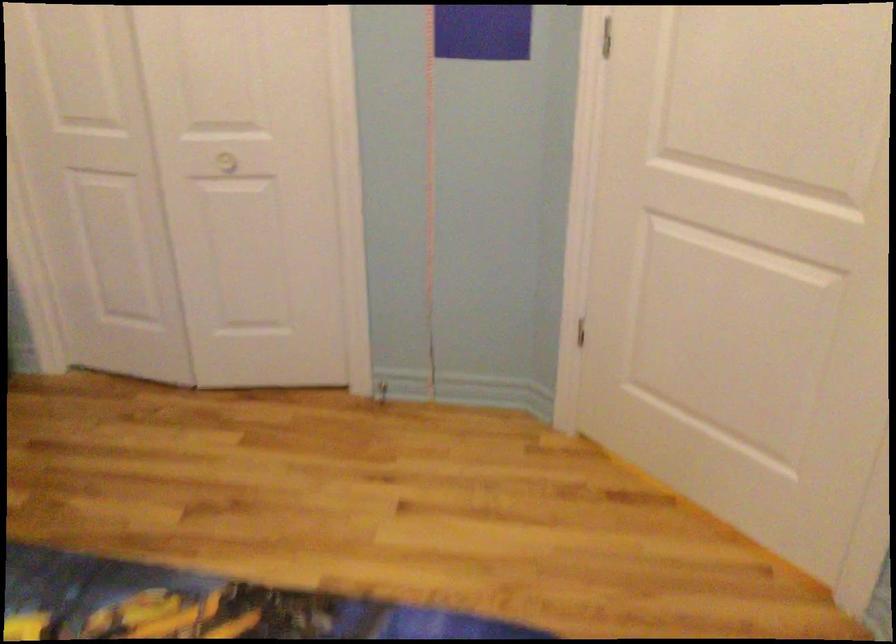
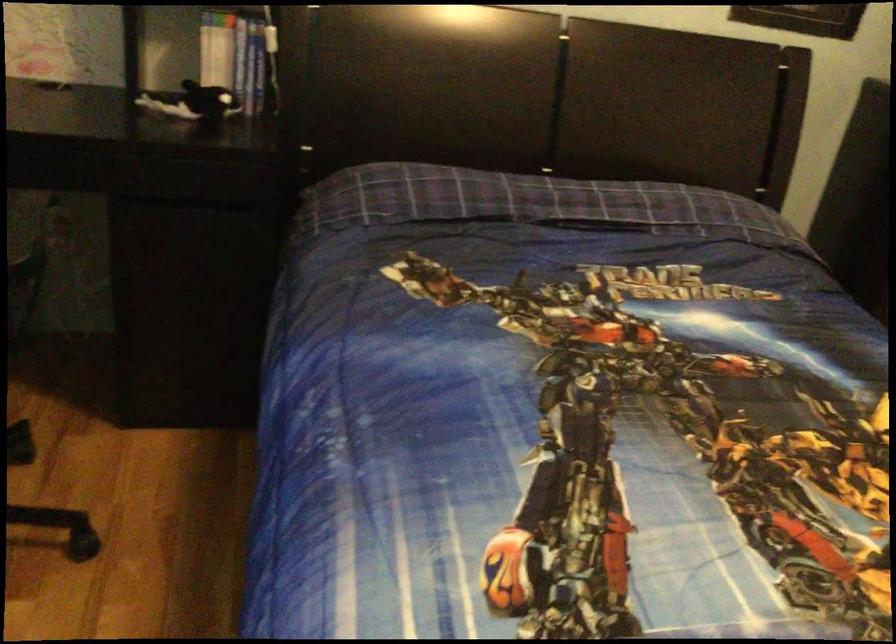
Question: The camera is either moving clockwise (left) or counter-clockwise (right) around the object. The first image is from the beginning of the video and the second image is from the end. Is the camera moving left or right when shooting the video?

Choices:
 (A) Left
 (B) Right

Answer: (B)